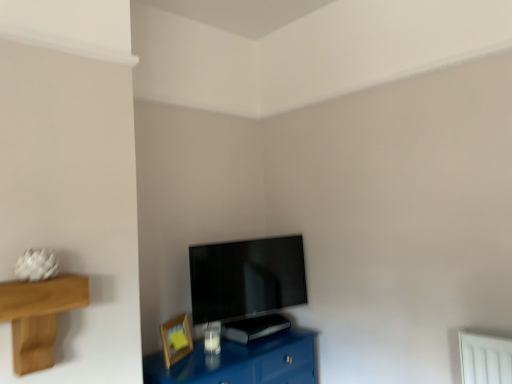
Question: In terms of size, does wooden picture frame at lower left appear bigger or smaller than glossy blue table at lower center?

Choices:
 (A) big
 (B) small

Answer: (B)

Question: Does point (175, 319) appear closer or farther from the camera than point (284, 379)?

Choices:
 (A) closer
 (B) farther

Answer: (B)

Question: Considering the real-world distances, which object is farthest from the flat screen tv at center?

Choices:
 (A) wooden picture frame at lower left
 (B) glossy blue table at lower center

Answer: (A)

Question: Which object is positioned closest to the flat screen tv at center?

Choices:
 (A) glossy blue table at lower center
 (B) wooden picture frame at lower left

Answer: (A)